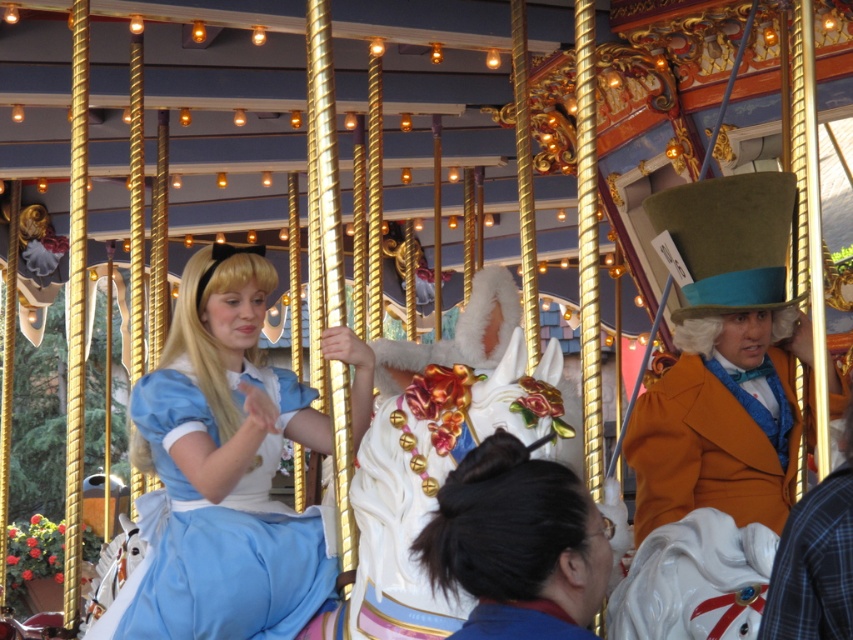
Question: Which is nearer to the blue satin dress at center?

Choices:
 (A) matte blue dress at center
 (B) orange velvet top hat at upper right
 (C) smooth brown hair at center

Answer: (C)

Question: Can you confirm if blue satin dress at center is positioned to the right of matte blue dress at center?

Choices:
 (A) yes
 (B) no

Answer: (B)

Question: Which point appears farthest from the camera in this image?

Choices:
 (A) (666, 397)
 (B) (227, 508)
 (C) (496, 620)

Answer: (A)

Question: In this image, where is blue satin dress at center located relative to orange velvet top hat at upper right?

Choices:
 (A) left
 (B) right

Answer: (A)

Question: Which object is positioned closest to the orange velvet top hat at upper right?

Choices:
 (A) blue satin dress at center
 (B) smooth brown hair at center
 (C) matte blue dress at center

Answer: (A)

Question: Is blue satin dress at center bigger than orange velvet top hat at upper right?

Choices:
 (A) yes
 (B) no

Answer: (A)